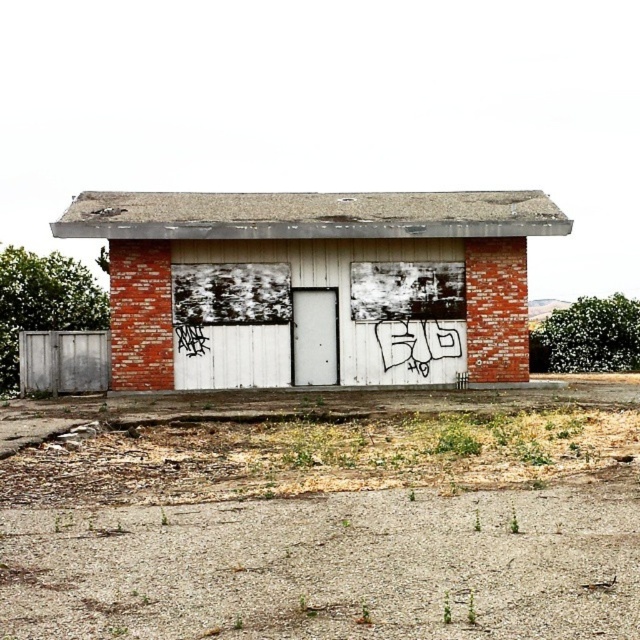
You are standing at the origin point of a coordinate system where the building is located at coordinates given. If you want to reach the brick building at center, in which general direction should you move from your current position?

The brick building at center is located at coordinates approximately 0.442 on the x and 0.492 on the y axis. Since you are at the origin, you should move in the positive x and positive y direction to reach it.

You are a delivery person trying to park your van in front of the brick building at center. The van is 2 meters wide. The white matte garage door at center is the only entrance. Can the van fit through the garage door?

The brick building at center is bigger than the white matte garage door at center, but the size of the garage door itself isn not specified. Therefore, it is unclear if the van can fit through the garage door based on the given information.

You are a delivery person approaching the gray metallic gate at lower left and the white matte garage door at center. Which object is closer to you as you approach the building?

The gray metallic gate at lower left is closer to you because it is in front of the white matte garage door at center.